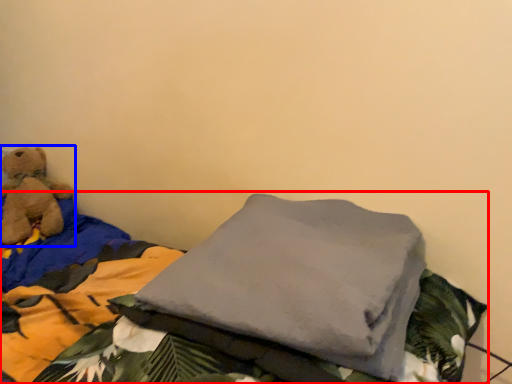
Question: Among these objects, which one is farthest to the camera, bed (highlighted by a red box) or teddy bear (highlighted by a blue box)?

Choices:
 (A) bed
 (B) teddy bear

Answer: (B)